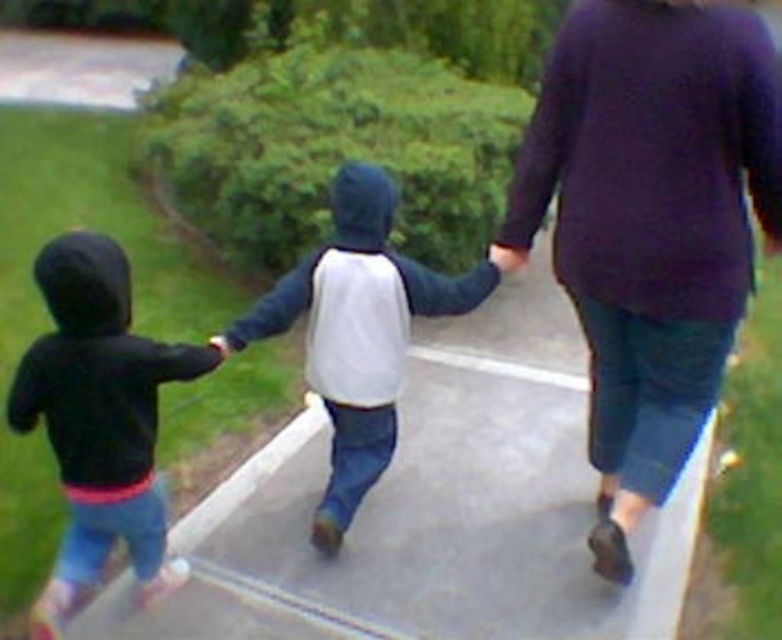
You are a delivery drone that needs to land on the white concrete pavement at center. However, your landing gear is 2 meters tall. Can you safely land there without hitting the matte black hoodie at left?

The white concrete pavement at center is not as tall as matte black hoodie at left, meaning the pavement is shorter. Since the landing gear is 2 meters tall, it might hit the matte black hoodie at left if the pavement is too low. Therefore, landing there could be unsafe due to the height difference.

You are a photographer trying to capture a photo of the purple sweater at upper right and the matte black hoodie at left. Which object should you focus on first if you want to include both in the frame without moving the camera?

The purple sweater at upper right is much taller than the matte black hoodie at left, so you should focus on the purple sweater at upper right first to ensure it fits within the frame.

You are standing at the point with coordinates point (377, 524) and want to walk towards the point with coordinates point (630, 115). According to the scene description, which direction should you face to move towards your destination?

Since point (377, 524) is behind point (630, 115), you should face forward to move towards your destination.